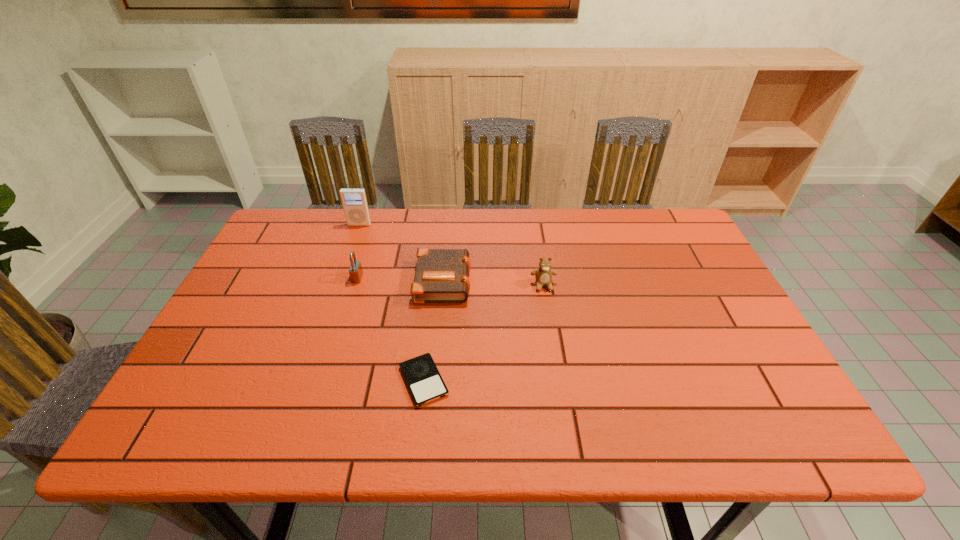
The height and width of the screenshot is (540, 960). Find the location of `vacant area between the second shortest object and the farthest object`. vacant area between the second shortest object and the farthest object is located at coordinates (401, 252).

Locate an element on the screen. free space between the farther iPod and the padlock is located at coordinates (358, 251).

Identify the location of vacant area between the shorter iPod and the Bible. (434, 330).

The width and height of the screenshot is (960, 540). I want to click on free point between the teddy bear and the Bible, so click(493, 282).

The image size is (960, 540). What are the coordinates of `free space between the shorter iPod and the taller iPod` in the screenshot? It's located at (392, 302).

This screenshot has width=960, height=540. Identify the location of free space between the Bible and the padlock. (400, 279).

I want to click on empty location between the shortest object and the Bible, so click(434, 330).

Where is `object that stands as the second closest to the tallest object`? object that stands as the second closest to the tallest object is located at coordinates (442, 275).

Locate which object is the third closest to the shortest object. Please provide its 2D coordinates. Your answer should be formatted as a tuple, i.e. [(x, y)], where the tuple contains the x and y coordinates of a point satisfying the conditions above.

[(543, 275)]

Where is `free space in the image that satisfies the following two spatial constraints: 1. on the front-facing side of the padlock; 2. on the left side of the farthest object`? free space in the image that satisfies the following two spatial constraints: 1. on the front-facing side of the padlock; 2. on the left side of the farthest object is located at coordinates (341, 278).